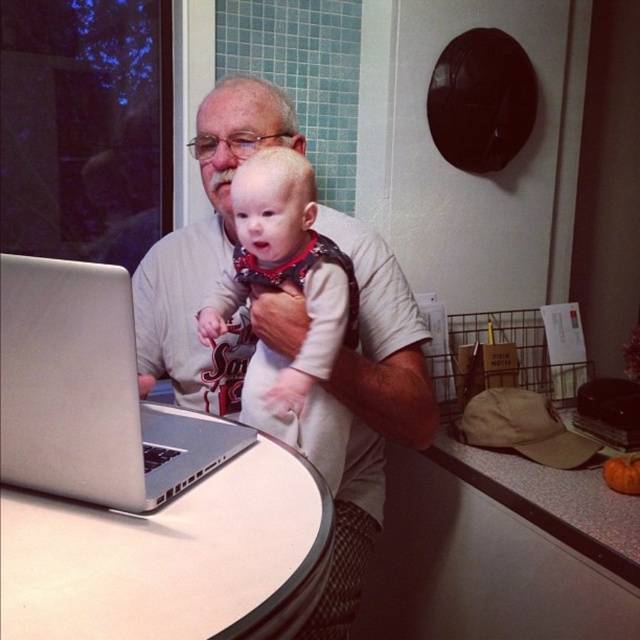
You are a delivery person who needs to place a package on the highest available surface in the room. Which object should you choose between the white laminate table at center and the speckled laminate counter top at lower right?

The white laminate table at center is located above the speckled laminate counter top at lower right, so the white laminate table at center is the higher surface and should be chosen for placing the package.